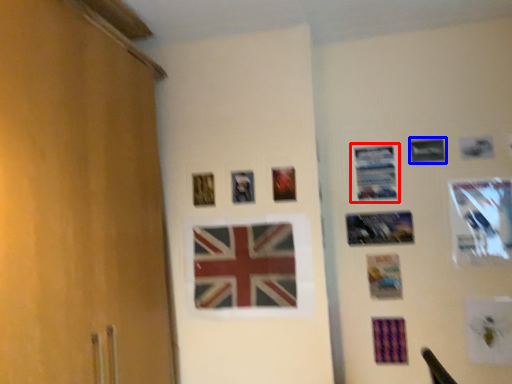
Question: Which object is closer to the camera taking this photo, picture frame (highlighted by a red box) or picture frame (highlighted by a blue box)?

Choices:
 (A) picture frame
 (B) picture frame

Answer: (B)